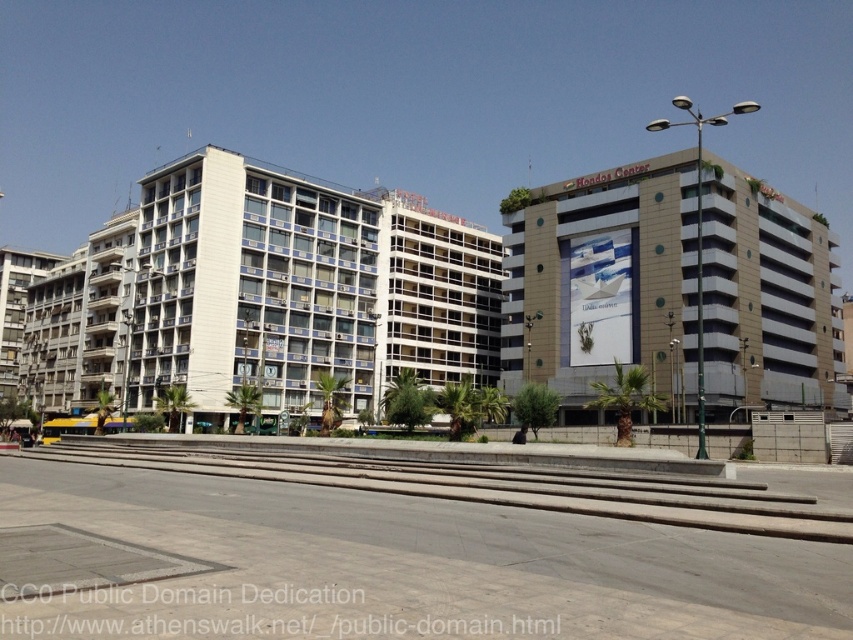
You are standing in the urban scene described. You want to reach the point at coordinates point (x=595, y=337). Given that you can walk 1.5 meters per second, how long will it take you to reach that point?

The point (x=595, y=337) is 104.48 meters away from you. At a walking speed of 1.5 meters per second, it would take approximately 69.65 seconds to reach the point.

You are a city planner analyzing the urban layout. Given the beige concrete building at upper right and the gray concrete train track at lower center, which one occupies a larger area in the scene?

The beige concrete building at upper right is bigger than the gray concrete train track at lower center, so the beige concrete building at upper right occupies a larger area in the scene.